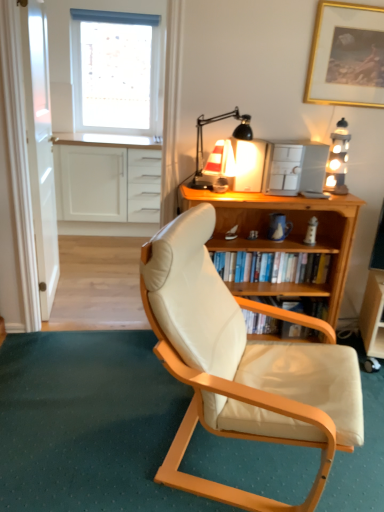
Locate an element on the screen. This screenshot has width=384, height=512. vacant space underneath matte cream leather chair at center (from a real-world perspective) is located at coordinates (250, 463).